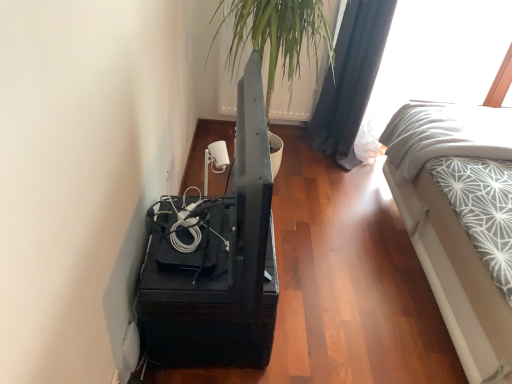
Question: In terms of height, does black matte tv stand at lower left look taller or shorter compared to transparent glass window at upper right?

Choices:
 (A) short
 (B) tall

Answer: (A)

Question: Considering their positions, is black matte tv stand at lower left located in front of or behind transparent glass window at upper right?

Choices:
 (A) front
 (B) behind

Answer: (A)

Question: Considering the real-world distances, which object is closest to the black fabric curtain at upper right?

Choices:
 (A) green leafy plant at upper center
 (B) white textured fabric at right
 (C) black matte tv stand at lower left
 (D) transparent glass window at upper right
 (E) white textured bed at right

Answer: (D)

Question: Which is farther from the white textured bed at right?

Choices:
 (A) black fabric curtain at upper right
 (B) black matte tv stand at lower left
 (C) white textured fabric at right
 (D) green leafy plant at upper center
 (E) transparent glass window at upper right

Answer: (B)